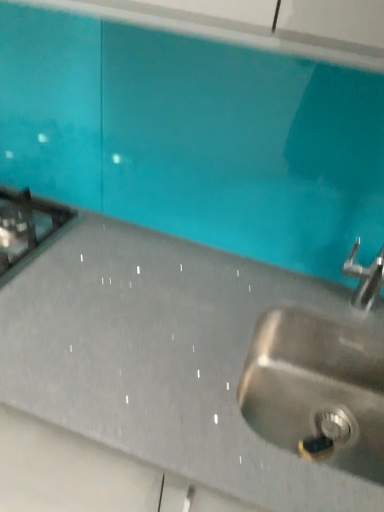
Measure the distance between point (320,429) and camera.

A distance of 96.00 centimeters exists between point (320,429) and camera.

At what (x,y) coordinates should I click in order to perform the action: click on stainless steel sink at lower right. Please return your answer as a coordinate pair (x, y). Looking at the image, I should click on (317, 390).

This screenshot has width=384, height=512. Describe the element at coordinates (317, 390) in the screenshot. I see `stainless steel sink at lower right` at that location.

In order to face stainless steel sink at lower right, should I rotate leftwards or rightwards?

You should look right and rotate roughly 16.788 degrees.

Where is `stainless steel sink at lower right`? This screenshot has width=384, height=512. stainless steel sink at lower right is located at coordinates (317, 390).